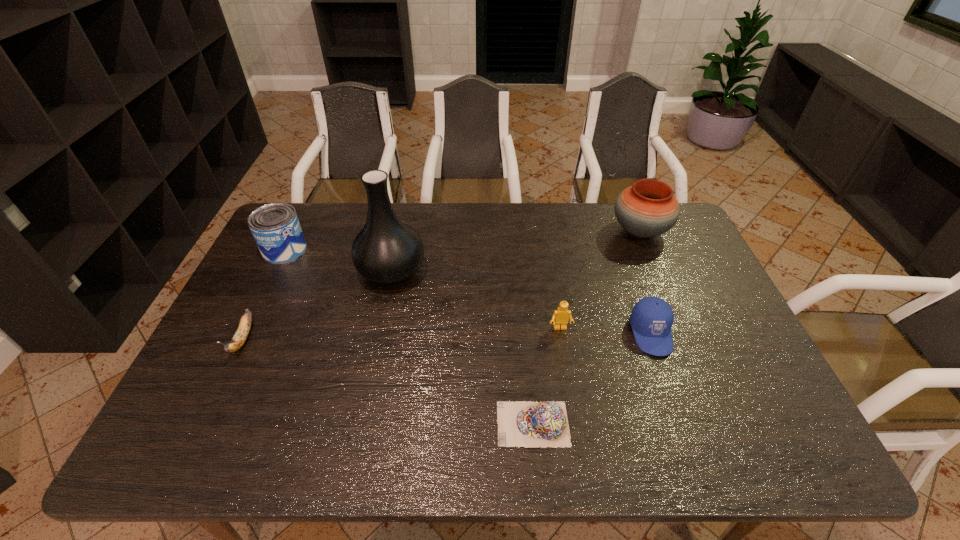
You are a GUI agent. You are given a task and a screenshot of the screen. Output one action in this format:
    pyautogui.click(x=<x>, y=<y>)
    Task: Click on the free space located on the back of the vase
    The width and height of the screenshot is (960, 540).
    Given the screenshot: What is the action you would take?
    pyautogui.click(x=404, y=209)

You are a GUI agent. You are given a task and a screenshot of the screen. Output one action in this format:
    pyautogui.click(x=<x>, y=<y>)
    Task: Click on the vacant space located 0.160m on the front of the sixth shortest object
    
    Given the screenshot: What is the action you would take?
    pyautogui.click(x=662, y=285)

Find the location of a particular element. The image size is (960, 540). free space located on the front label of the can is located at coordinates (388, 250).

You are a GUI agent. You are given a task and a screenshot of the screen. Output one action in this format:
    pyautogui.click(x=<x>, y=<y>)
    Task: Click on the vacant space located 0.200m on the face of the Lego
    This screenshot has width=960, height=540.
    Given the screenshot: What is the action you would take?
    pyautogui.click(x=572, y=398)

This screenshot has height=540, width=960. Identify the location of vacant space located 0.180m on the front-facing side of the right cap. (683, 422).

Image resolution: width=960 pixels, height=540 pixels. Find the location of `vacant space located on the peel of the banana`. vacant space located on the peel of the banana is located at coordinates (197, 435).

This screenshot has width=960, height=540. In order to click on free region located on the front, side, and top of the nearest object in this screenshot , I will do point(410,424).

The height and width of the screenshot is (540, 960). Find the location of `free space located on the front, side, and top of the nearest object`. free space located on the front, side, and top of the nearest object is located at coordinates (471, 424).

You are a GUI agent. You are given a task and a screenshot of the screen. Output one action in this format:
    pyautogui.click(x=<x>, y=<y>)
    Task: Click on the blank area located on the front, side, and top of the nearest object
    This screenshot has height=540, width=960.
    Given the screenshot: What is the action you would take?
    pyautogui.click(x=475, y=424)

Locate an element on the screen. pottery that is at the far edge is located at coordinates (648, 208).